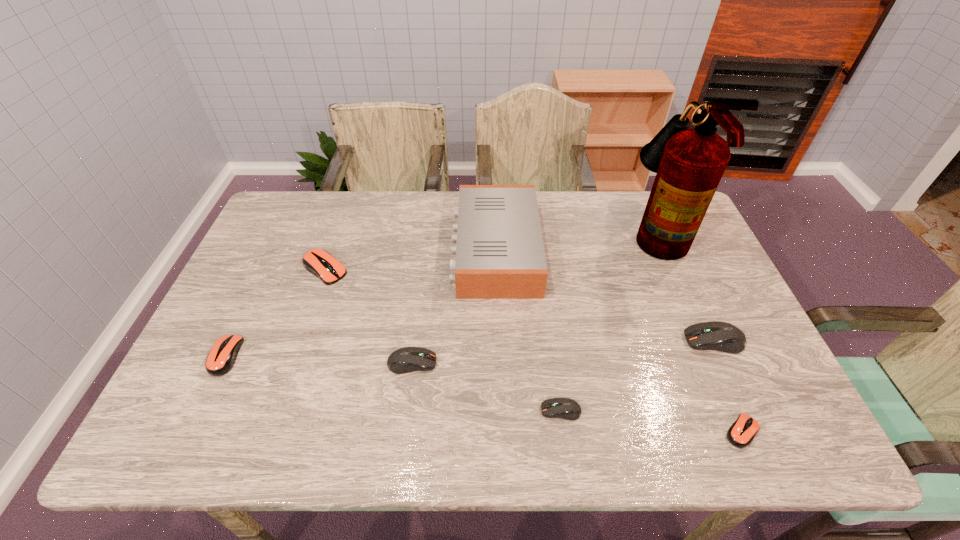
At what (x,y) coordinates should I click in order to perform the action: click on vacant space at the far left corner of the desktop. Please return your answer as a coordinate pair (x, y). Looking at the image, I should click on (268, 220).

This screenshot has height=540, width=960. What are the coordinates of `vacant space in between the second biggest orange computer mouse and the smallest dark computer equipment` in the screenshot? It's located at (394, 383).

Where is `free spot between the radio receiver and the nearest dark computer equipment`? The height and width of the screenshot is (540, 960). free spot between the radio receiver and the nearest dark computer equipment is located at coordinates (528, 330).

Locate an element on the screen. The height and width of the screenshot is (540, 960). vacant area between the leftmost object and the shortest computer mouse is located at coordinates (484, 394).

This screenshot has width=960, height=540. Identify the location of empty space that is in between the second orange computer mouse from left to right and the second tallest object. (410, 260).

The image size is (960, 540). I want to click on empty location between the second orange computer mouse from right to left and the third tallest object, so click(x=519, y=305).

The image size is (960, 540). What are the coordinates of `free area in between the smallest orange computer mouse and the farthest computer mouse` in the screenshot? It's located at (534, 350).

Find the location of `free spot between the rightmost orange computer mouse and the farthest orange computer mouse`. free spot between the rightmost orange computer mouse and the farthest orange computer mouse is located at coordinates coord(534,350).

Find the location of a particular element. The width and height of the screenshot is (960, 540). empty location between the second dark computer equipment from right to left and the second farthest orange computer mouse is located at coordinates (394, 383).

Identify the location of empty space between the radio receiver and the second orange computer mouse from left to right. The height and width of the screenshot is (540, 960). (410, 260).